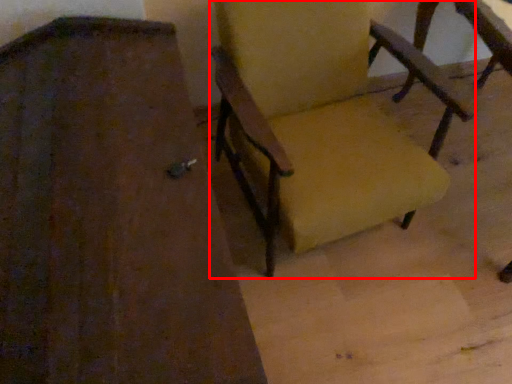
Question: Considering the relative positions of chair (annotated by the red box) and chair in the image provided, where is chair (annotated by the red box) located with respect to the staircase?

Choices:
 (A) right
 (B) left

Answer: (A)